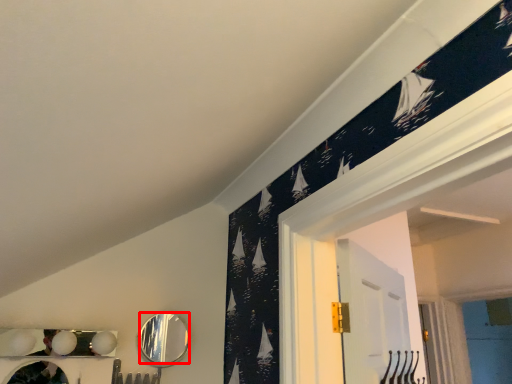
Question: From the image's perspective, considering the relative positions of mirror (annotated by the red box) and mirror in the image provided, where is mirror (annotated by the red box) located with respect to the staircase?

Choices:
 (A) above
 (B) below

Answer: (A)